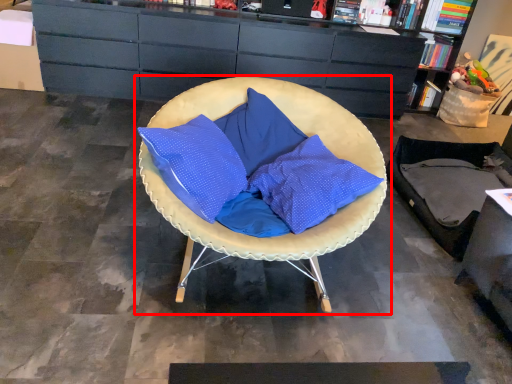
Question: From the image's perspective, where is chair (annotated by the red box) located relative to cabinetry?

Choices:
 (A) above
 (B) below

Answer: (B)